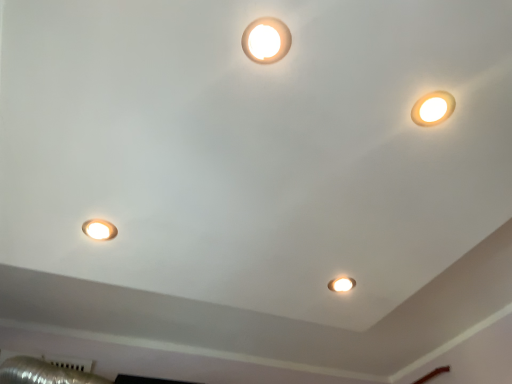
Question: Is matte white spotlight at center bigger or smaller than matte white light fixture at upper center, which appears as the 2th lamp when viewed from the right?

Choices:
 (A) small
 (B) big

Answer: (A)

Question: Is matte white spotlight at center in front of or behind matte white light fixture at upper center, the 2th lamp from the left, in the image?

Choices:
 (A) front
 (B) behind

Answer: (B)

Question: Which object is positioned farthest from the matte white spotlight at center?

Choices:
 (A) matte white lamp at upper right, marked as the second lamp in a front-to-back arrangement
 (B) matte white lamp at lower left, the 1th lamp from the left
 (C) matte white light fixture at upper center, positioned as the 3th lamp in back-to-front order

Answer: (C)

Question: Considering the real-world distances, which object is closest to the matte white lamp at upper right, marked as the second lamp in a front-to-back arrangement?

Choices:
 (A) matte white light fixture at upper center, acting as the 3th lamp starting from the bottom
 (B) matte white spotlight at center
 (C) matte white lamp at lower left, the first lamp when ordered from bottom to top

Answer: (A)